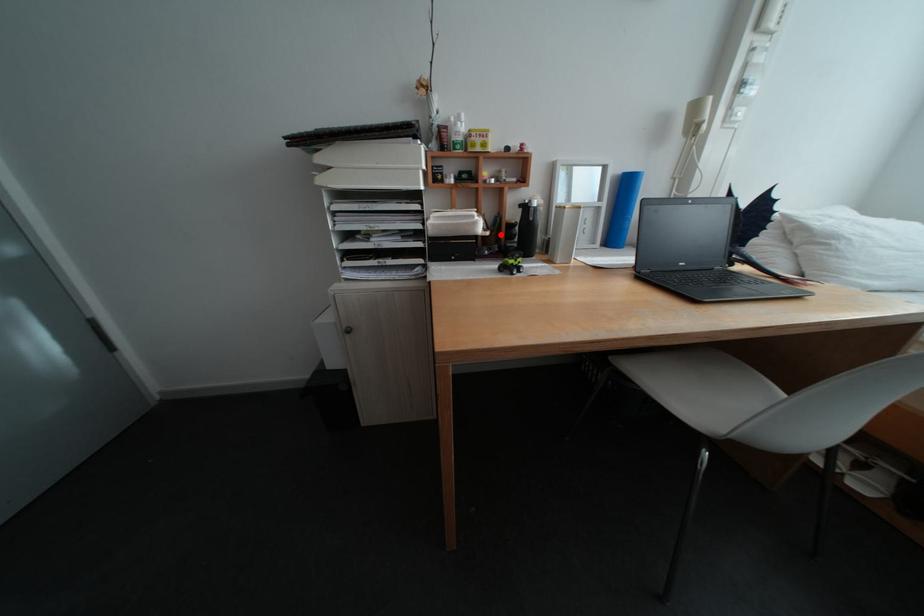
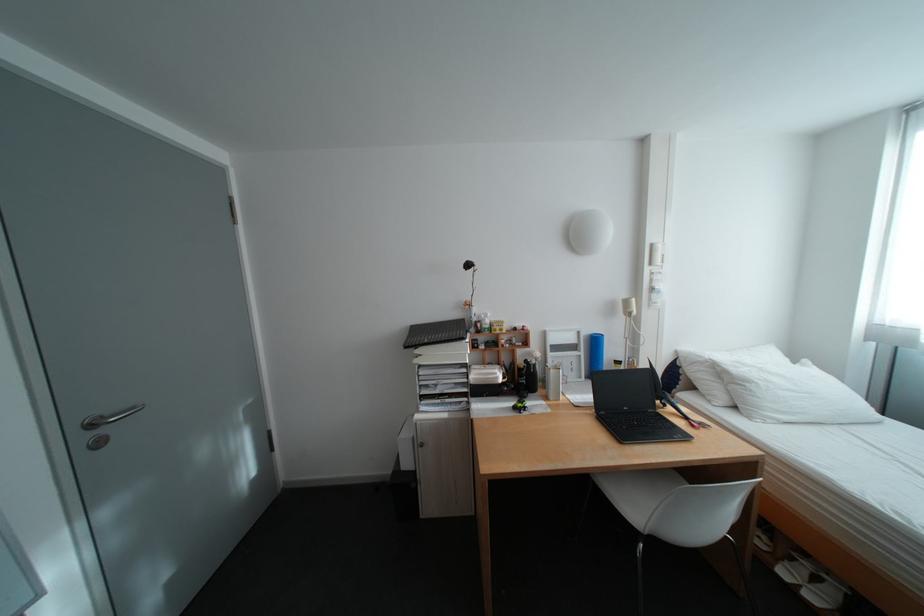
The point at the highlighted location is marked in the first image. Where is the corresponding point in the second image?

(518, 381)